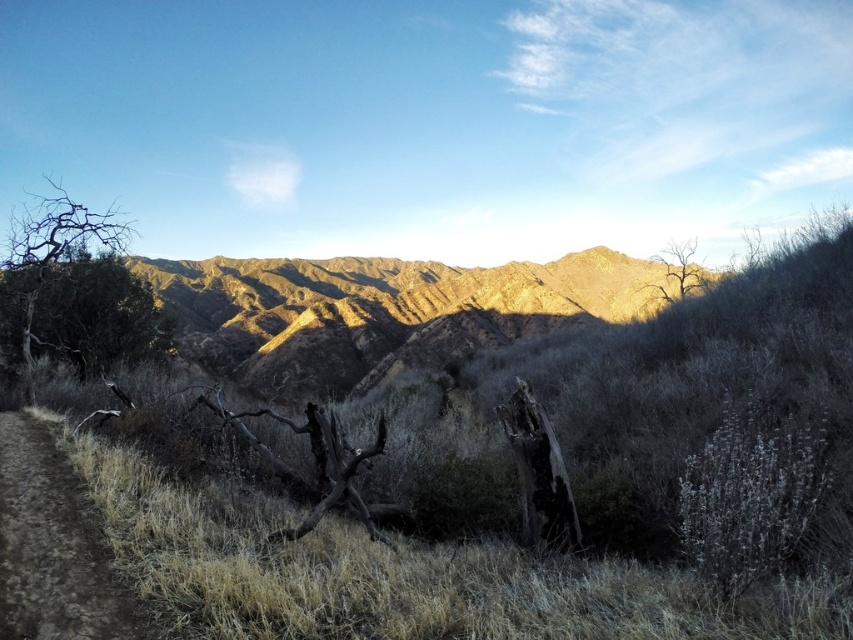
You are a hiker planning to follow the brown dirt track at lower left towards the bare wood tree at upper right. Since the track is narrow, will you be able to walk along it comfortably?

The brown dirt track at lower left is thinner than the bare wood tree at upper right, so it may be challenging to walk along the track comfortably due to its narrow width.

You are planning a hiking route and need to decide whether to go through the brown rocky mountain range at center or around the bare wood tree at left. Which path would allow you to cover more horizontal distance in the same amount of time?

The brown rocky mountain range at center has a larger width than the bare wood tree at left, so traversing the path through the brown rocky mountain range at center would require covering more horizontal distance compared to going around the bare wood tree at left. Therefore, to cover more distance in the same time, choose the path through the brown rocky mountain range at center.